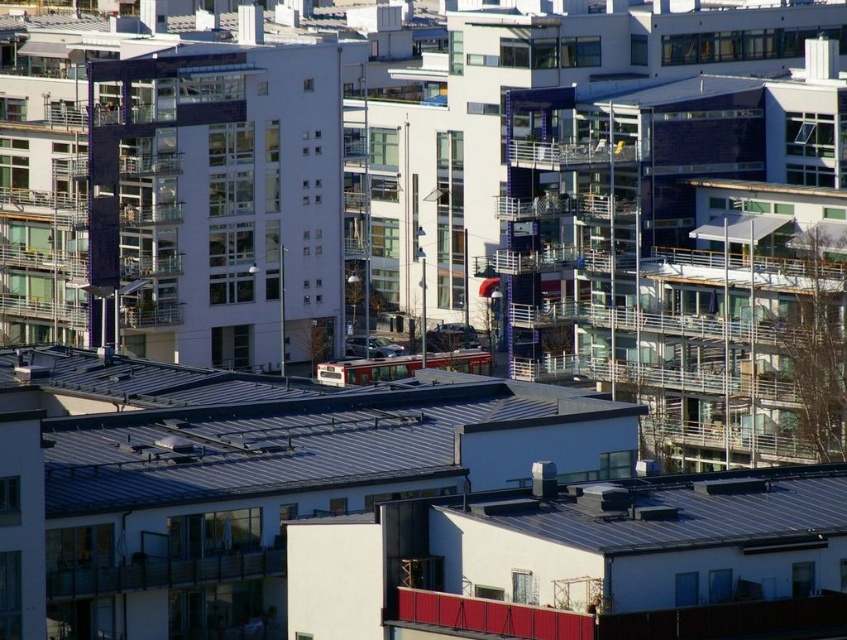
You are a drone operator who needs to fly a drone from the metallic gray roof at center to the metallic gray roof at lower right. Considering the height difference between the two roofs, will the drone have to ascend or descend during the flight?

The metallic gray roof at center is taller than the metallic gray roof at lower right, so the drone will have to descend during the flight.

You are standing at the point with coordinates point (582, 499) and want to walk towards the point with coordinates point (502, 432). Which direction should you move to reach your destination?

To reach point (502, 432) from point (582, 499), you should move towards the northwest direction since point (502, 432) is located to the northwest of point (582, 499).